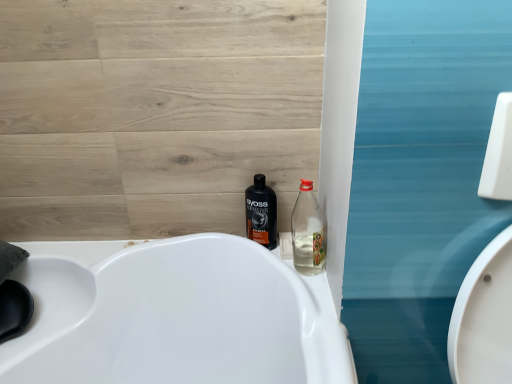
Question: Is point (312, 221) positioned closer to the camera than point (276, 233)?

Choices:
 (A) farther
 (B) closer

Answer: (B)

Question: Considering the positions of clear plastic bottle at center-right, placed as the 1th bottle when sorted from front to back, and shiny black bottle at center, the second bottle positioned from the front, in the image, is clear plastic bottle at center-right, placed as the 1th bottle when sorted from front to back, bigger or smaller than shiny black bottle at center, the second bottle positioned from the front,?

Choices:
 (A) big
 (B) small

Answer: (A)

Question: Which is correct: clear plastic bottle at center-right, arranged as the first bottle when viewed from the right, is inside shiny black bottle at center, the second bottle positioned from the front, or outside of it?

Choices:
 (A) outside
 (B) inside

Answer: (A)

Question: Does point (258, 203) appear closer or farther from the camera than point (315, 226)?

Choices:
 (A) farther
 (B) closer

Answer: (B)

Question: Considering the positions of shiny black bottle at center, the second bottle positioned from the front, and clear plastic bottle at center-right, the 2th bottle in the left-to-right sequence, in the image, is shiny black bottle at center, the second bottle positioned from the front, wider or thinner than clear plastic bottle at center-right, the 2th bottle in the left-to-right sequence,?

Choices:
 (A) thin
 (B) wide

Answer: (B)

Question: Do you think shiny black bottle at center, which is counted as the 2th bottle, starting from the right, is within clear plastic bottle at center-right, placed as the 1th bottle when sorted from front to back, or outside of it?

Choices:
 (A) outside
 (B) inside

Answer: (A)

Question: From their relative heights in the image, would you say shiny black bottle at center, the first bottle in the back-to-front sequence, is taller or shorter than clear plastic bottle at center-right, the second bottle when ordered from back to front?

Choices:
 (A) short
 (B) tall

Answer: (B)